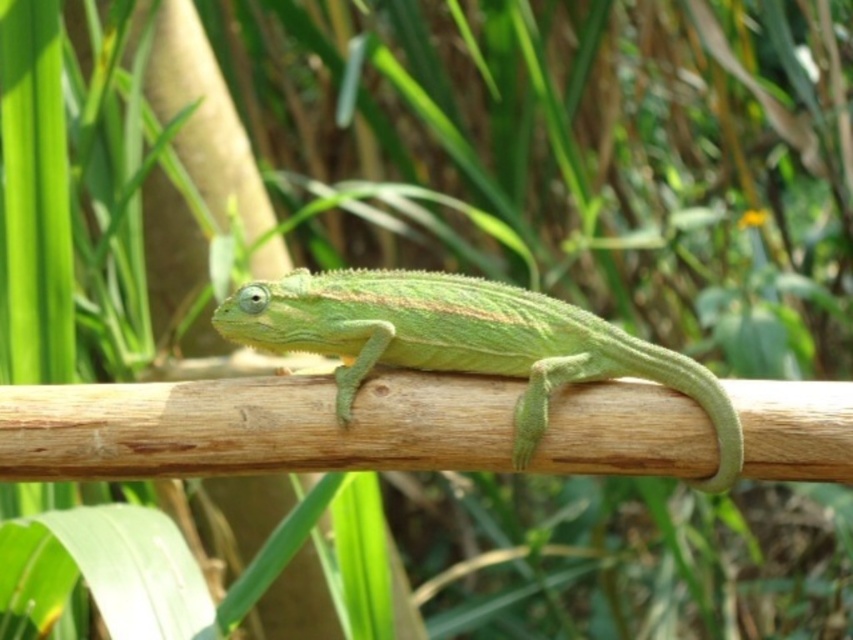
You are a photographer trying to capture the green matte lizard at center. You notice the smooth wood branch at center is blocking your view. Is the branch to the left or right of the lizard?

The smooth wood branch at center is positioned on the left side of green matte lizard at center, so the branch is to the left of the lizard.

You are an animal caretaker observing the green matte lizard at center and the smooth wood branch at center. Which object has a rougher texture when touched?

The green matte lizard at center has a rougher texture than the smooth wood branch at center because its scales are described as slightly rough to the touch.